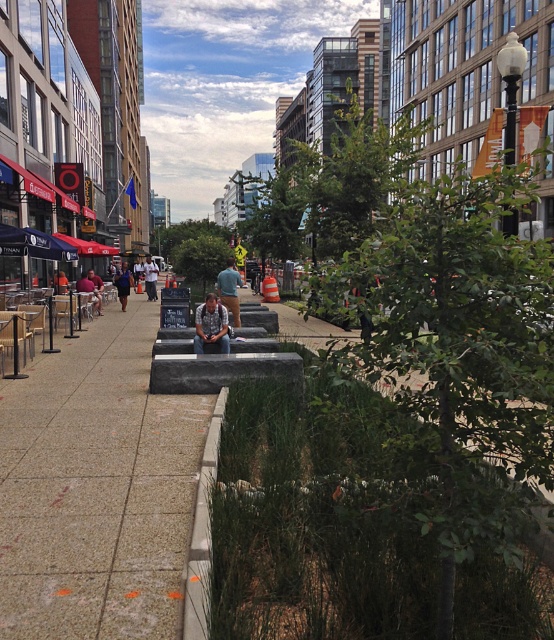
You are a person who wants to sit down on the dark gray concrete bench at center. However, there is a person wearing a dark blue shirt at center sitting on it. Can you sit on the bench without moving the person?

The dark gray concrete bench at center has a smaller size compared to dark blue shirt at center, so it is likely too small to accommodate both of you comfortably. You may need to find another bench or wait until the person leaves.

You are standing at the point marked as point (96,488) in the image. What is the surface you are currently standing on?

The point (96,488) is on gray concrete bench at center, so you are standing on a gray concrete bench at center.